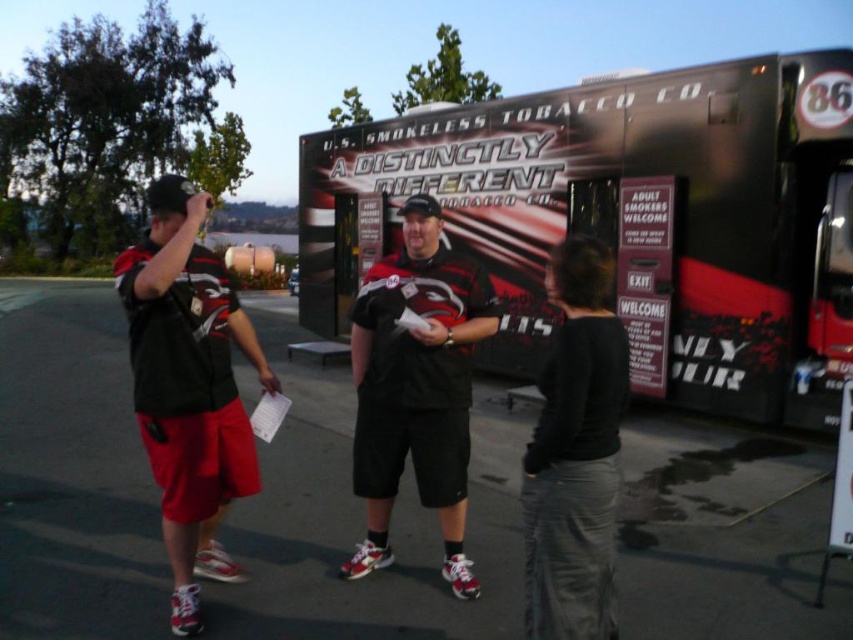
What are the coordinates of the metallic silver food truck at center?

The coordinates of the metallic silver food truck at center are 0.347 on the x axis and 0.739 on the y axis.